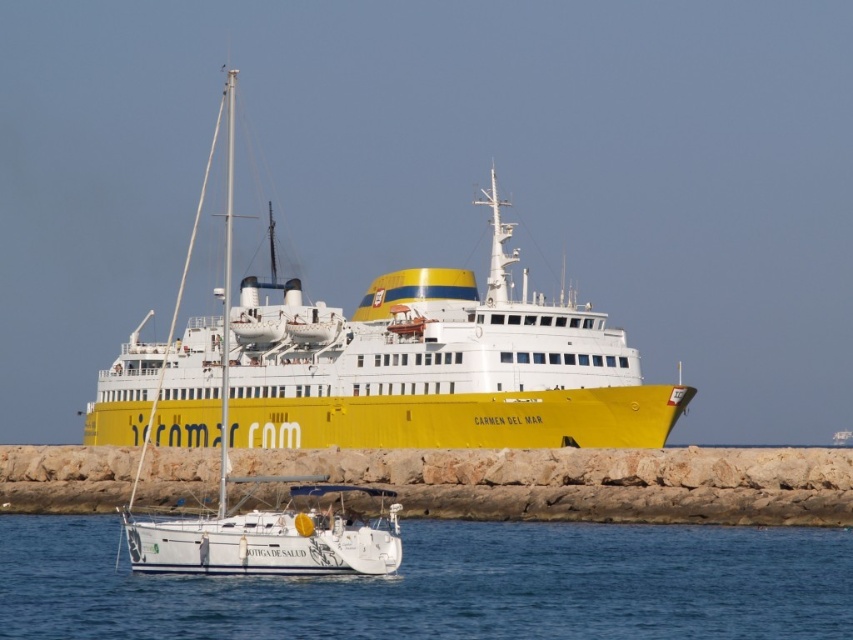
Is yellow matte ship at center above transparent blue water at lower center?

Yes, yellow matte ship at center is above transparent blue water at lower center.

Is yellow matte ship at center further to camera compared to transparent blue water at lower center?

Yes.

The width and height of the screenshot is (853, 640). What do you see at coordinates (386, 364) in the screenshot?
I see `yellow matte ship at center` at bounding box center [386, 364].

Locate an element on the screen. yellow matte ship at center is located at coordinates (386, 364).